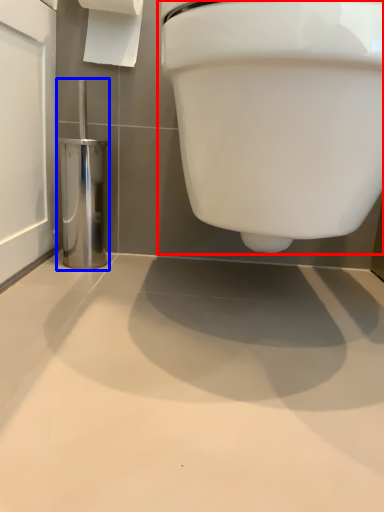
Question: Which point is further to the camera, toilet (highlighted by a red box) or porcelain (highlighted by a blue box)?

Choices:
 (A) toilet
 (B) porcelain

Answer: (B)